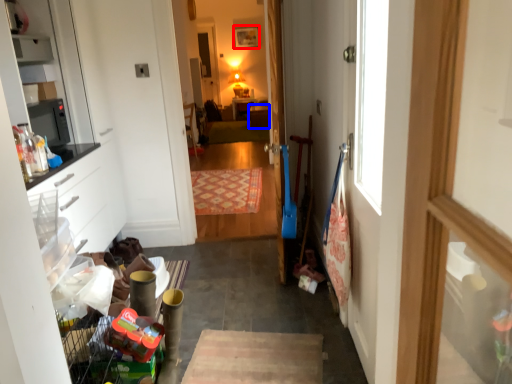
Question: Which point is closer to the camera, picture frame (highlighted by a red box) or cabinetry (highlighted by a blue box)?

Choices:
 (A) picture frame
 (B) cabinetry

Answer: (B)